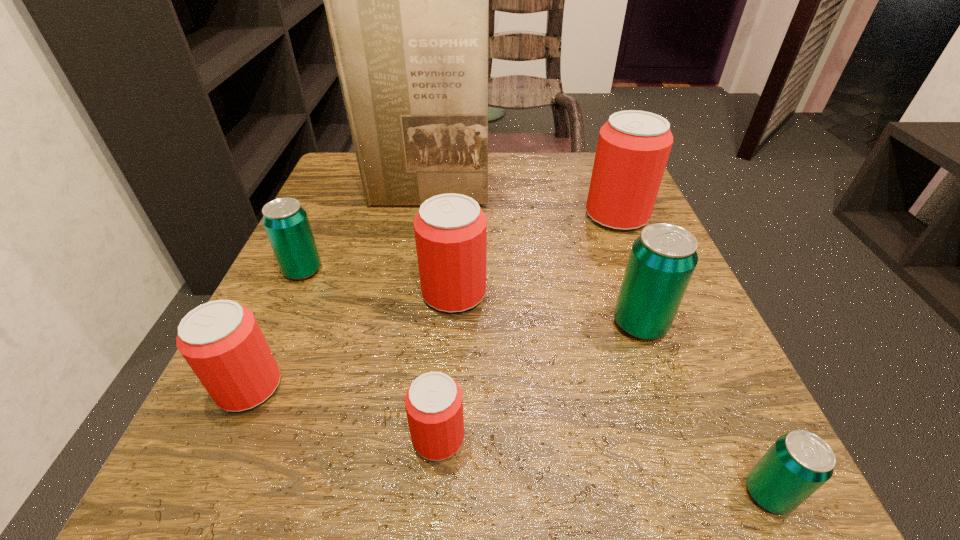
The width and height of the screenshot is (960, 540). In order to click on the nearest beer can in this screenshot , I will do `click(798, 463)`.

Where is `the nearest object`? The width and height of the screenshot is (960, 540). the nearest object is located at coordinates (798, 463).

Where is `free space located 0.280m on the cover of the tallest object`? The height and width of the screenshot is (540, 960). free space located 0.280m on the cover of the tallest object is located at coordinates (408, 303).

The image size is (960, 540). I want to click on free space located on the left of the biggest red beer can, so click(x=508, y=215).

The width and height of the screenshot is (960, 540). I want to click on vacant space located 0.090m on the left of the third nearest red beer can, so click(x=368, y=293).

Identify the location of free space located 0.380m on the back of the second farthest teal beer can. (589, 184).

At what (x,y) coordinates should I click in order to perform the action: click on free space located on the front of the second smallest red beer can. Please return your answer as a coordinate pair (x, y). The image size is (960, 540). Looking at the image, I should click on (212, 469).

At what (x,y) coordinates should I click in order to perform the action: click on vacant area situated on the right of the farthest teal beer can. Please return your answer as a coordinate pair (x, y). This screenshot has height=540, width=960. Looking at the image, I should click on (368, 271).

The image size is (960, 540). I want to click on vacant area located on the right of the smallest red beer can, so click(642, 437).

Find the location of `free space located on the left of the nearest object`. free space located on the left of the nearest object is located at coordinates (461, 494).